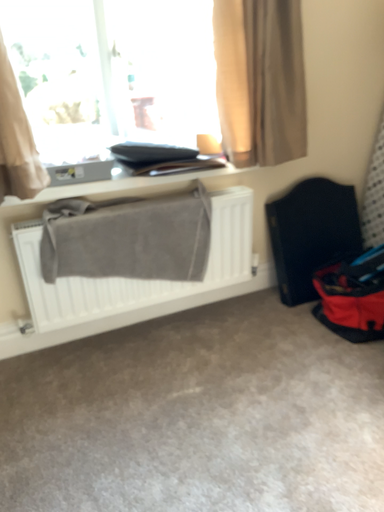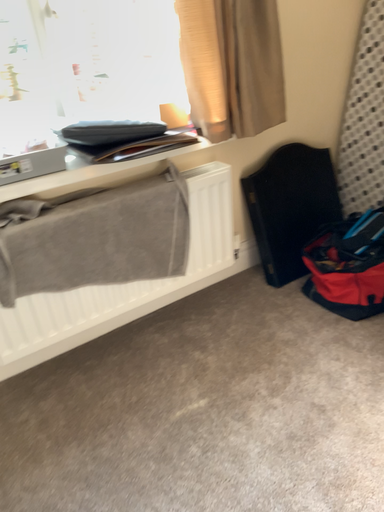
Question: How did the camera likely rotate when shooting the video?

Choices:
 (A) rotated right
 (B) rotated left

Answer: (A)